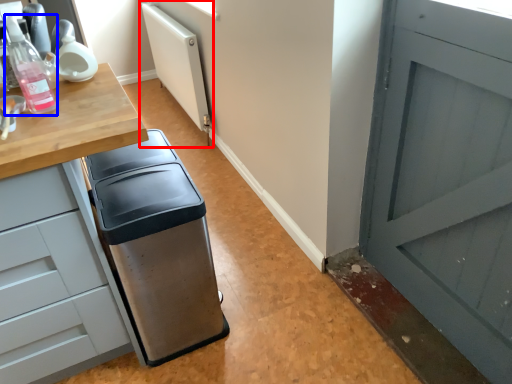
Question: Which object is further to the camera taking this photo, radiator (highlighted by a red box) or bottle (highlighted by a blue box)?

Choices:
 (A) radiator
 (B) bottle

Answer: (A)